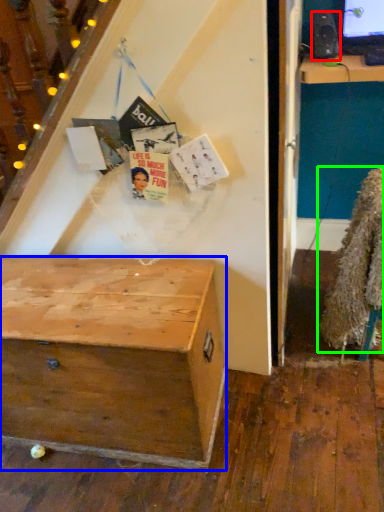
Question: Based on their relative distances, which object is nearer to loudspeaker (highlighted by a red box)? Choose from desk (highlighted by a blue box) and fur coat (highlighted by a green box).

Choices:
 (A) desk
 (B) fur coat

Answer: (B)